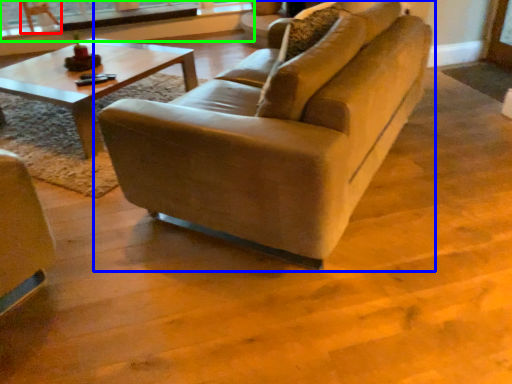
Question: Based on their relative distances, which object is nearer to armchair (highlighted by a red box)? Choose from studio couch (highlighted by a blue box) and window frame (highlighted by a green box).

Choices:
 (A) studio couch
 (B) window frame

Answer: (B)